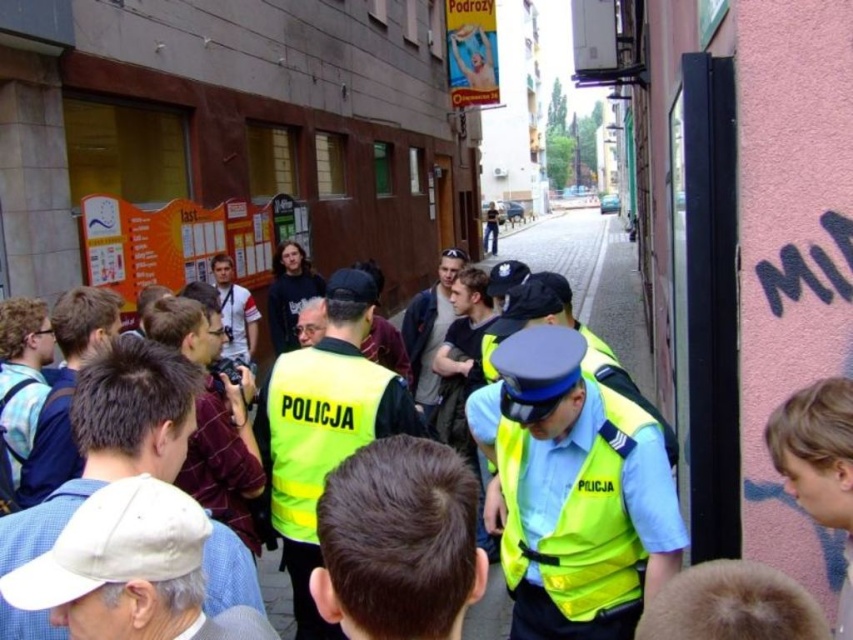
Based on the photo, you are a pedestrian on the street and notice two groups of people wearing yellow reflective vests. The first group is wearing a neon yellow reflective vest at center, and the second group has yellow reflective vests at center. Which group is closer to you?

The neon yellow reflective vest at center is positioned over yellow reflective vests at center, so the first group wearing the neon yellow reflective vest at center is closer to you.